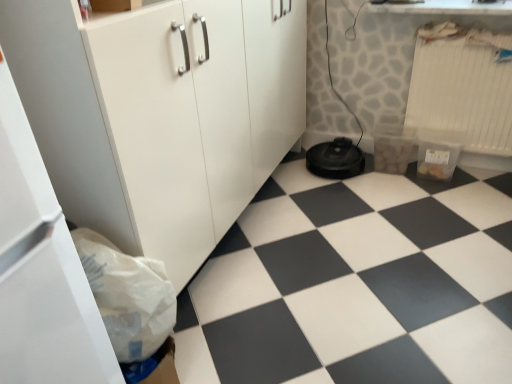
You are a GUI agent. You are given a task and a screenshot of the screen. Output one action in this format:
    pyautogui.click(x=<x>, y=<y>)
    Task: Click on the free location to the left of black plastic robot vacuum cleaner at lower center
    
    Given the screenshot: What is the action you would take?
    pyautogui.click(x=291, y=170)